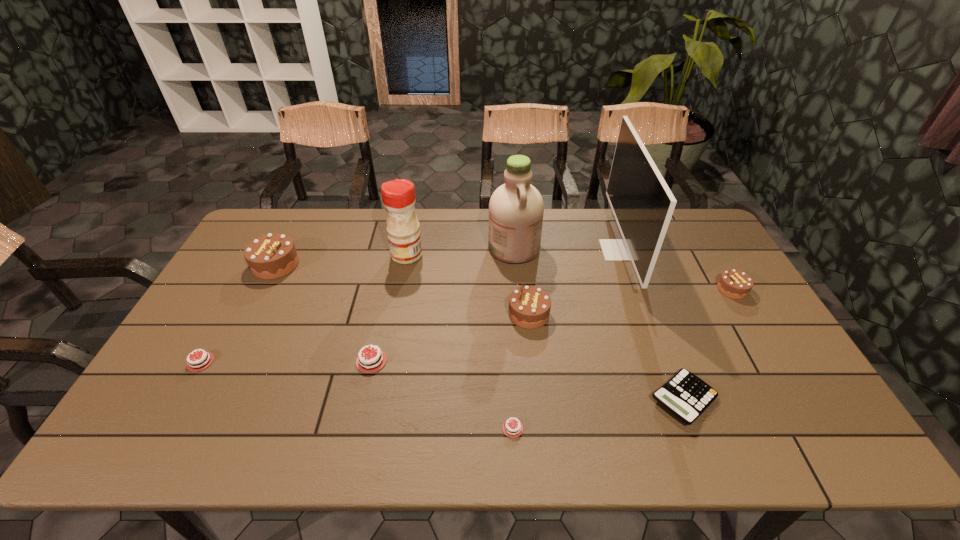
Find the location of a particular element. The width and height of the screenshot is (960, 540). red chocolate cake that is the closest to the second brown chocolate cake from right to left is located at coordinates (512, 428).

In order to click on free space that satisfies the following two spatial constraints: 1. on the front-facing side of the rightmost object; 2. on the right side of the monitor in this screenshot , I will do `click(634, 289)`.